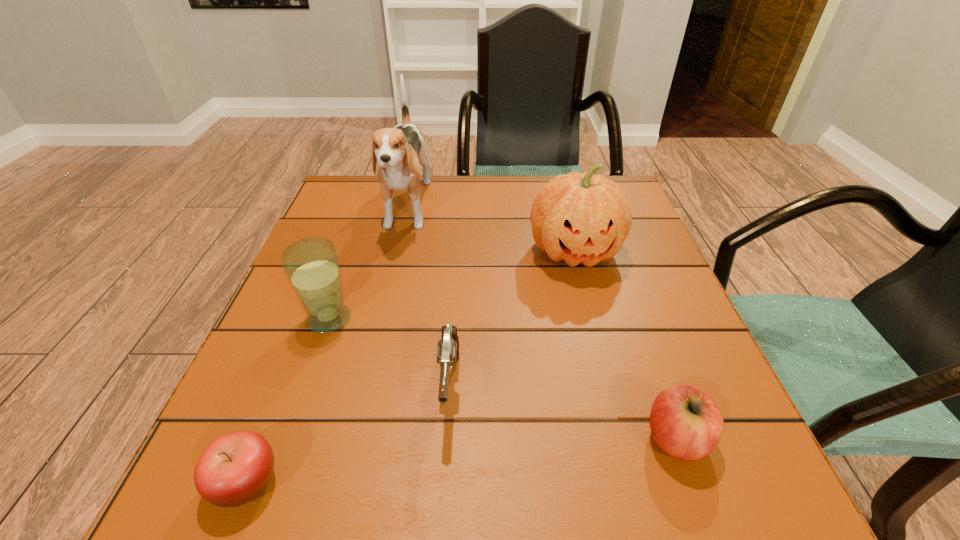
In order to click on puppy in this screenshot , I will do `click(399, 151)`.

Where is `the tallest object`? the tallest object is located at coordinates (399, 151).

Where is `the second tallest object`? This screenshot has width=960, height=540. the second tallest object is located at coordinates (584, 218).

Where is `the third farthest object`? the third farthest object is located at coordinates (312, 266).

This screenshot has height=540, width=960. I want to click on glass, so click(x=312, y=266).

Identify the location of pistol. This screenshot has width=960, height=540. (448, 347).

Where is `the right apple`? the right apple is located at coordinates (685, 422).

The image size is (960, 540). In order to click on the left apple in this screenshot , I will do `click(236, 467)`.

Identify the location of vacant space located 0.100m at the face of the tallest object. The height and width of the screenshot is (540, 960). (391, 281).

This screenshot has height=540, width=960. What are the coordinates of `free region located on the carved face of the fifth shortest object` in the screenshot? It's located at (608, 380).